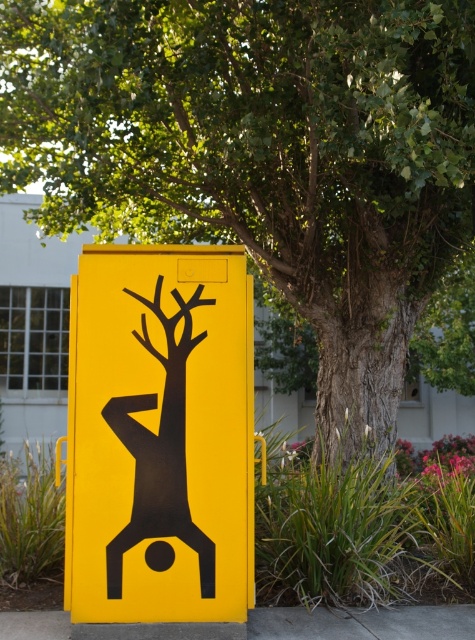
Between matte yellow sign at center and concrete at center, which one is positioned lower?

concrete at center is below.

Who is higher up, matte yellow sign at center or concrete at center?

matte yellow sign at center is higher up.

The width and height of the screenshot is (475, 640). What do you see at coordinates (160, 435) in the screenshot? I see `matte yellow sign at center` at bounding box center [160, 435].

I want to click on matte yellow sign at center, so click(x=160, y=435).